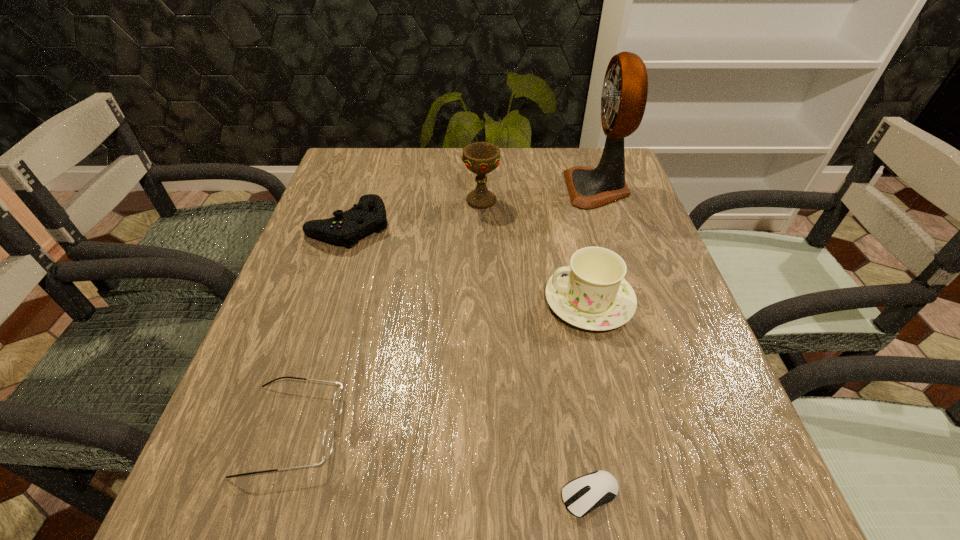
In the image, there is a desktop. In order to click on vacant space at the left edge in this screenshot , I will do `click(275, 400)`.

Find the location of a particular element. The height and width of the screenshot is (540, 960). vacant space at the right edge is located at coordinates (677, 328).

This screenshot has width=960, height=540. I want to click on vacant area at the far left corner of the desktop, so click(391, 172).

Where is `free space at the near left corner of the desktop`? The height and width of the screenshot is (540, 960). free space at the near left corner of the desktop is located at coordinates (294, 495).

In the image, there is a desktop. Where is `free space at the near right corner`? The image size is (960, 540). free space at the near right corner is located at coordinates (774, 513).

I want to click on free area in between the tallest object and the fourth farthest object, so click(593, 245).

You are a GUI agent. You are given a task and a screenshot of the screen. Output one action in this format:
    pyautogui.click(x=<x>, y=<y>)
    Task: Click on the vacant space that is in between the spectacles and the shortest object
    The image size is (960, 540).
    Given the screenshot: What is the action you would take?
    pyautogui.click(x=442, y=462)

I want to click on unoccupied area between the second tallest object and the fourth shortest object, so click(535, 251).

This screenshot has width=960, height=540. What are the coordinates of `vacant region between the shortest object and the third object from left to right` in the screenshot? It's located at (536, 348).

I want to click on vacant area that lies between the chinaware and the spectacles, so click(x=441, y=365).